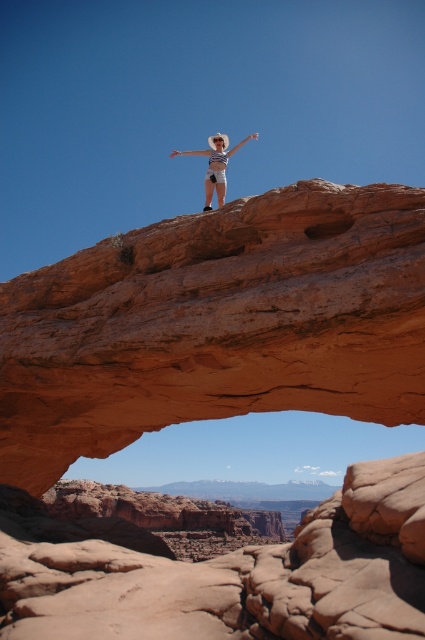
You are a photographer planning to capture the rustic sandstone arch at center and the matte white hat at center in a single frame. Based on their sizes, which object should you focus on to ensure both are clearly visible?

The rustic sandstone arch at center is smaller than the matte white hat at center, so focusing on the smaller rustic sandstone arch at center will help ensure both objects are clearly visible in the frame.

You are a photographer planning to take a wide shot of the rustic sandstone arch at center and the matte white hat at center. Based on their sizes, which object should you focus on to ensure both fit in the frame without cropping?

The rustic sandstone arch at center might be wider than the matte white hat at center, so focusing on the arch would allow both to fit in the frame without cropping.